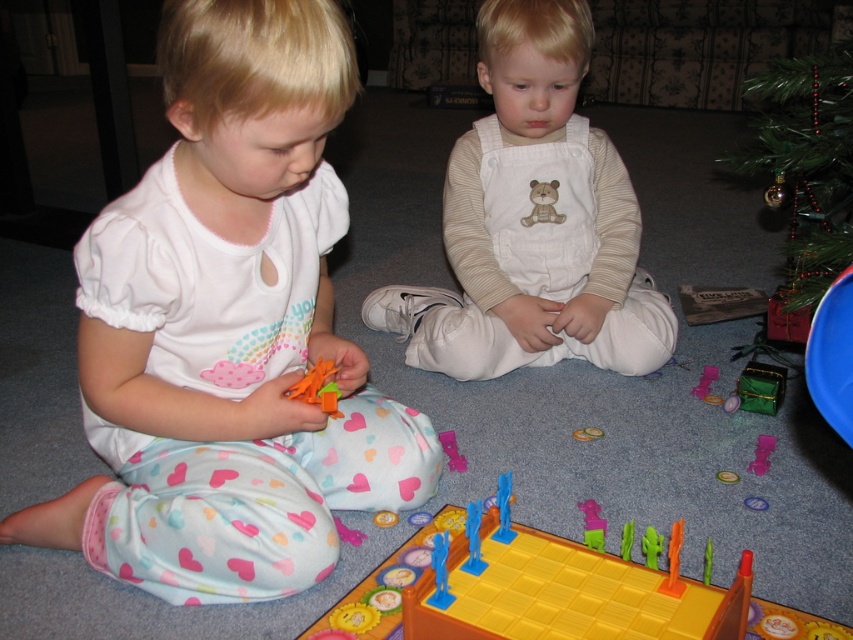
Question: Does pink plastic toy at center have a smaller size compared to pink plastic toy at lower center?

Choices:
 (A) yes
 (B) no

Answer: (B)

Question: Among these points, which one is farthest from the camera?

Choices:
 (A) (825, 115)
 (B) (556, 182)

Answer: (B)

Question: Which object is the farthest from the yellow plastic board game at lower center?

Choices:
 (A) white cotton overalls at center
 (B) translucent plastic toy at center
 (C) pink plastic toy at center
 (D) matte white shirt at center

Answer: (A)

Question: Can you confirm if matte white shirt at center is thinner than translucent plastic game piece at center?

Choices:
 (A) no
 (B) yes

Answer: (A)

Question: Is pink plastic toy at lower center smaller than translucent plastic game piece at center?

Choices:
 (A) no
 (B) yes

Answer: (A)

Question: Estimate the real-world distances between objects in this image. Which object is closer to the green textured christmas tree at upper right?

Choices:
 (A) translucent plastic toy at center
 (B) pink plastic toy at center

Answer: (B)